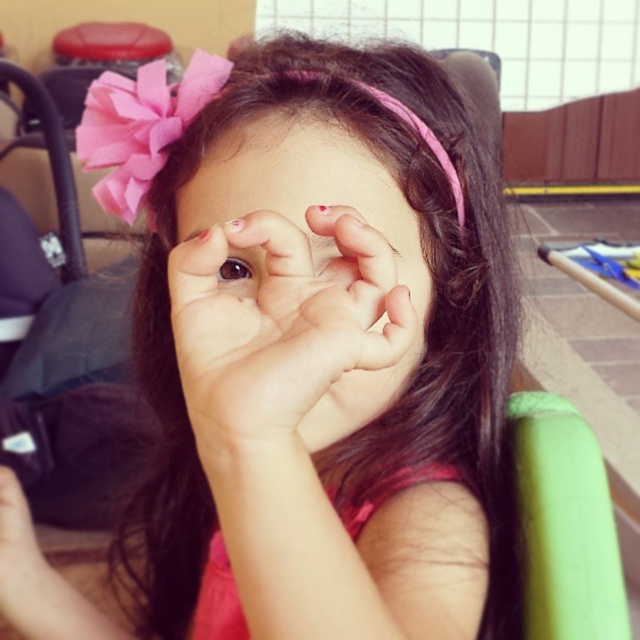
Does smooth skin face at center have a lesser width compared to brown shiny eye at center?

Incorrect, smooth skin face at center's width is not less than brown shiny eye at center's.

Which is more to the right, smooth skin face at center or brown shiny eye at center?

smooth skin face at center

Identify the location of smooth skin face at center. This screenshot has width=640, height=640. [x=312, y=232].